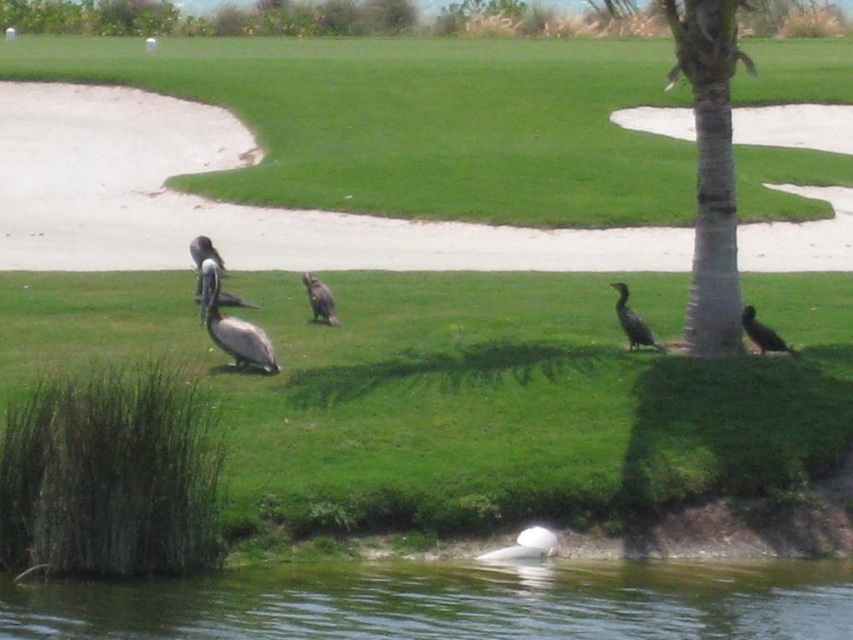
In the scene shown: You are standing at the edge of the water and want to place a small boat exactly at the center of the greenish water at lower center. According to the coordinates provided, where should you place the boat?

The boat should be placed at the coordinates point (x=448, y=604) where the greenish water at lower center is located.

Looking at this image, you are a birdwatcher observing the scene. You notice the dark brown feathers at center and the brown feathered pelican at upper left. Which object takes up more space in the image?

The brown feathered pelican at upper left takes up more space in the image than the dark brown feathers at center.